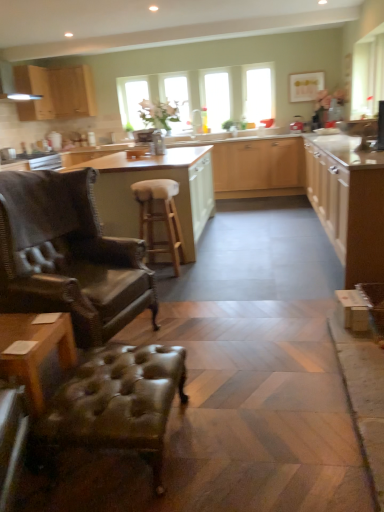
I want to click on matte wood cabinetry at center, which is the second cabinetry from right to left, so click(315, 189).

Measure the distance between point (219, 128) and camera.

Point (219, 128) is 6.47 meters from camera.

Measure the distance between matte wood cabinet at upper left, placed as the fourth cabinetry when sorted from right to left, and camera.

matte wood cabinet at upper left, placed as the fourth cabinetry when sorted from right to left, is 21.49 feet away from camera.

Where is `matte wood cabinet at upper left, placed as the fourth cabinetry when sorted from right to left`? matte wood cabinet at upper left, placed as the fourth cabinetry when sorted from right to left is located at coordinates (55, 92).

At what (x,y) coordinates should I click in order to perform the action: click on clear glass window at center, positioned as the 1th window screen in left-to-right order. Please return your answer as a coordinate pair (x, y). Looking at the image, I should click on (177, 99).

Where is `matte wood cabinetry at center, which is the second cabinetry from right to left`? matte wood cabinetry at center, which is the second cabinetry from right to left is located at coordinates (315, 189).

Can you confirm if matte wood cabinet at right, positioned as the fourth cabinetry in left-to-right order, is thinner than leather tufted ottoman at lower left?

No, matte wood cabinet at right, positioned as the fourth cabinetry in left-to-right order, is not thinner than leather tufted ottoman at lower left.

Could you tell me if matte wood cabinet at right, positioned as the fourth cabinetry in left-to-right order, is facing leather tufted ottoman at lower left?

No, matte wood cabinet at right, positioned as the fourth cabinetry in left-to-right order, is not aimed at leather tufted ottoman at lower left.

How different are the orientations of matte wood cabinet at right, positioned as the fourth cabinetry in left-to-right order, and leather tufted ottoman at lower left in degrees?

The angle between the facing direction of matte wood cabinet at right, positioned as the fourth cabinetry in left-to-right order, and the facing direction of leather tufted ottoman at lower left is 177 degrees.

Is matte wood cabinet at right, positioned as the fourth cabinetry in left-to-right order, at the left side of leather tufted ottoman at lower left?

No.

This screenshot has height=512, width=384. What are the coordinates of `cabinetry that is the 3rd one when counting rightward from the matte wood cabinet at upper left, placed as the fourth cabinetry when sorted from right to left` in the screenshot? It's located at (348, 203).

Which is closer to the camera, (46,106) or (333,207)?

Positioned in front is point (333,207).

Between matte wood cabinet at upper left, placed as the fourth cabinetry when sorted from right to left, and matte wood cabinet at right, positioned as the fourth cabinetry in left-to-right order, which one has less height?

Standing shorter between the two is matte wood cabinet at upper left, placed as the fourth cabinetry when sorted from right to left.

Is matte wood cabinet at upper left, acting as the 1th cabinetry starting from the left, facing towards matte wood cabinet at right, the first cabinetry when ordered from right to left?

Yes, matte wood cabinet at upper left, acting as the 1th cabinetry starting from the left, is facing matte wood cabinet at right, the first cabinetry when ordered from right to left.

From a real-world perspective, is matte wood cabinet at upper left, acting as the 1th cabinetry starting from the left, under transparent glass window at upper center, which ranks as the 2th window in left-to-right order?

No, from a real-world perspective, matte wood cabinet at upper left, acting as the 1th cabinetry starting from the left, is not below transparent glass window at upper center, which ranks as the 2th window in left-to-right order.

What's the angular difference between matte wood cabinet at upper left, acting as the 1th cabinetry starting from the left, and transparent glass window at upper center, positioned as the 1th window in right-to-left order,'s facing directions?

The angular difference between matte wood cabinet at upper left, acting as the 1th cabinetry starting from the left, and transparent glass window at upper center, positioned as the 1th window in right-to-left order, is 88.5 degrees.

Considering the sizes of objects matte wood cabinet at upper left, acting as the 1th cabinetry starting from the left, and transparent glass window at upper center, positioned as the 1th window in right-to-left order, in the image provided, who is thinner, matte wood cabinet at upper left, acting as the 1th cabinetry starting from the left, or transparent glass window at upper center, positioned as the 1th window in right-to-left order,?

transparent glass window at upper center, positioned as the 1th window in right-to-left order, is thinner.

In the image, is matte wood cabinet at upper left, acting as the 1th cabinetry starting from the left, on the left side or the right side of transparent glass window at upper center, positioned as the 1th window in right-to-left order?

Based on their positions, matte wood cabinet at upper left, acting as the 1th cabinetry starting from the left, is located to the left of transparent glass window at upper center, positioned as the 1th window in right-to-left order.

Are transparent glass window at upper center, positioned as the 1th window in right-to-left order, and matte wood cabinet at upper left, acting as the 1th cabinetry starting from the left, far apart?

Yes, transparent glass window at upper center, positioned as the 1th window in right-to-left order, is far from matte wood cabinet at upper left, acting as the 1th cabinetry starting from the left.

Is transparent glass window at upper center, positioned as the 1th window in right-to-left order, looking in the opposite direction of matte wood cabinet at upper left, placed as the fourth cabinetry when sorted from right to left?

transparent glass window at upper center, positioned as the 1th window in right-to-left order, does not have its back to matte wood cabinet at upper left, placed as the fourth cabinetry when sorted from right to left.

Is matte wood cabinet at upper left, placed as the fourth cabinetry when sorted from right to left, completely or partially inside transparent glass window at upper center, which ranks as the 2th window in left-to-right order?

No, matte wood cabinet at upper left, placed as the fourth cabinetry when sorted from right to left, is not a part of transparent glass window at upper center, which ranks as the 2th window in left-to-right order.

Which is less distant, (257, 66) or (54, 105)?

Point (257, 66) is closer to the camera than point (54, 105).

Is matte wood cabinet at right, the first cabinetry when ordered from right to left, positioned with its back to transparent glass window at center, the first window screen viewed from the right?

No, matte wood cabinet at right, the first cabinetry when ordered from right to left,'s orientation is not away from transparent glass window at center, the first window screen viewed from the right.

From a real-world perspective, is matte wood cabinet at right, positioned as the fourth cabinetry in left-to-right order, physically above transparent glass window at center, the first window screen viewed from the right?

Incorrect, from a real-world perspective, matte wood cabinet at right, positioned as the fourth cabinetry in left-to-right order, is lower than transparent glass window at center, the first window screen viewed from the right.

Between matte wood cabinet at right, positioned as the fourth cabinetry in left-to-right order, and transparent glass window at center, the first window screen viewed from the right, which one is positioned behind?

transparent glass window at center, the first window screen viewed from the right, is further away from the camera.

Is matte wood cabinet at right, positioned as the fourth cabinetry in left-to-right order, not inside transparent glass window at center, which is the 2th window screen in left-to-right order?

Indeed, matte wood cabinet at right, positioned as the fourth cabinetry in left-to-right order, is completely outside transparent glass window at center, which is the 2th window screen in left-to-right order.

Consider the image. Is matte wood cabinet at right, positioned as the fourth cabinetry in left-to-right order, located outside matte wood cabinet at upper left, placed as the fourth cabinetry when sorted from right to left?

Yes, matte wood cabinet at right, positioned as the fourth cabinetry in left-to-right order, is not within matte wood cabinet at upper left, placed as the fourth cabinetry when sorted from right to left.

Is matte wood cabinet at right, the first cabinetry when ordered from right to left, taller or shorter than matte wood cabinet at upper left, placed as the fourth cabinetry when sorted from right to left?

Clearly, matte wood cabinet at right, the first cabinetry when ordered from right to left, is taller compared to matte wood cabinet at upper left, placed as the fourth cabinetry when sorted from right to left.

Is matte wood cabinet at upper left, placed as the fourth cabinetry when sorted from right to left, at the back of matte wood cabinet at right, positioned as the fourth cabinetry in left-to-right order?

No, matte wood cabinet at right, positioned as the fourth cabinetry in left-to-right order, is not facing away from matte wood cabinet at upper left, placed as the fourth cabinetry when sorted from right to left.

Is point (377, 272) positioned after point (80, 114)?

No, it is not.

Considering the points (271, 86) and (30, 372), which point is in front, point (271, 86) or point (30, 372)?

Point (30, 372)

From the image's perspective, between transparent glass window at upper center, which ranks as the 2th window in left-to-right order, and wooden table at lower left, who is located below?

wooden table at lower left is shown below in the image.

Can you tell me how much transparent glass window at upper center, which ranks as the 2th window in left-to-right order, and wooden table at lower left differ in facing direction?

They differ by 91.5 degrees in their facing directions.

The image size is (384, 512). Find the location of `table lying on the left of transparent glass window at upper center, positioned as the 1th window in right-to-left order`. table lying on the left of transparent glass window at upper center, positioned as the 1th window in right-to-left order is located at coordinates (35, 350).

Locate an element on the screen. swivel chair below the matte wood cabinet at right, the first cabinetry when ordered from right to left (from the image's perspective) is located at coordinates (115, 404).

Find the location of `cabinetry that is the 3rd object to the right of the matte wood cabinet at upper left, placed as the fourth cabinetry when sorted from right to left, starting at the anchor`. cabinetry that is the 3rd object to the right of the matte wood cabinet at upper left, placed as the fourth cabinetry when sorted from right to left, starting at the anchor is located at coordinates (348, 203).

Based on their spatial positions, is leather wingback chair at left or clear glass window at upper center, which is counted as the 1th window, starting from the left, closer to white wood bar stool at center, which is counted as the third cabinetry, starting from the right?

leather wingback chair at left.

From the picture: Looking at the image, which one is located further to wooden table at lower left, wooden stool at center or matte wood cabinet at upper left, placed as the fourth cabinetry when sorted from right to left?

matte wood cabinet at upper left, placed as the fourth cabinetry when sorted from right to left, lies further to wooden table at lower left than the other object.

From the image, which object appears to be nearer to leather tufted ottoman at lower left, clear glass window at center, the 2th window screen positioned from the right, or wooden table at lower left?

wooden table at lower left is positioned closer to the anchor leather tufted ottoman at lower left.

Considering their positions, is matte wood cabinet at upper left, placed as the fourth cabinetry when sorted from right to left, positioned closer to matte wood cabinet at right, positioned as the fourth cabinetry in left-to-right order, than clear glass window at center, positioned as the 1th window screen in left-to-right order?

clear glass window at center, positioned as the 1th window screen in left-to-right order, lies closer to matte wood cabinet at right, positioned as the fourth cabinetry in left-to-right order, than the other object.

Estimate the real-world distances between objects in this image. Which object is further from clear glass window at upper center, which is counted as the 1th window, starting from the left, leather wingback chair at left or wooden stool at center?

The object further to clear glass window at upper center, which is counted as the 1th window, starting from the left, is leather wingback chair at left.

Looking at the image, which one is located further to wooden stool at center, clear glass window at upper center, acting as the 2th window starting from the right, or clear glass window at center, positioned as the 1th window screen in left-to-right order?

clear glass window at upper center, acting as the 2th window starting from the right, is further to wooden stool at center.

When comparing their distances from matte wood cabinet at upper left, acting as the 1th cabinetry starting from the left, does wooden table at lower left or white wood bar stool at center, which is counted as the third cabinetry, starting from the right, seem closer?

white wood bar stool at center, which is counted as the third cabinetry, starting from the right.

Considering their positions, is clear glass window at upper center, acting as the 2th window starting from the right, positioned closer to clear glass window at center, positioned as the 1th window screen in left-to-right order, than wooden stool at center?

clear glass window at upper center, acting as the 2th window starting from the right, lies closer to clear glass window at center, positioned as the 1th window screen in left-to-right order, than the other object.

At what (x,y) coordinates should I click in order to perform the action: click on chair between matte wood cabinetry at center, which ranks as the 3th cabinetry in left-to-right order, and leather tufted ottoman at lower left, in the vertical direction. Please return your answer as a coordinate pair (x, y). This screenshot has height=512, width=384. Looking at the image, I should click on (68, 256).

Where is `stool positioned between wooden table at lower left and clear glass window at upper center, acting as the 2th window starting from the right, from near to far`? The width and height of the screenshot is (384, 512). stool positioned between wooden table at lower left and clear glass window at upper center, acting as the 2th window starting from the right, from near to far is located at coordinates (160, 218).

Locate an element on the screen. window located between matte wood cabinet at upper left, acting as the 1th cabinetry starting from the left, and transparent glass window at upper center, which ranks as the 2th window in left-to-right order, in the left-right direction is located at coordinates (131, 100).

Where is `table located between leather tufted ottoman at lower left and clear glass window at upper center, acting as the 2th window starting from the right, in the depth direction`? table located between leather tufted ottoman at lower left and clear glass window at upper center, acting as the 2th window starting from the right, in the depth direction is located at coordinates (35, 350).